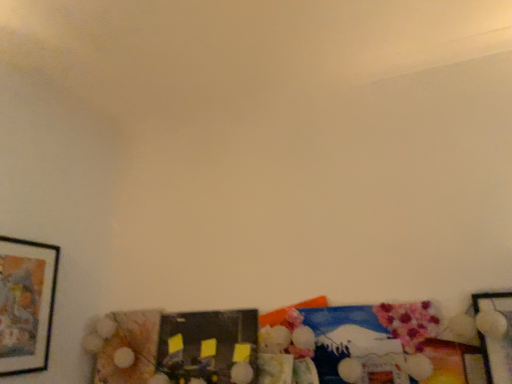
Question: From the image's perspective, is matte black picture frame at center, placed as the second picture frame when sorted from left to right, under matte black picture frame at left, acting as the 3th picture frame starting from the right?

Choices:
 (A) no
 (B) yes

Answer: (B)

Question: Is the position of matte black picture frame at center, placed as the second picture frame when sorted from left to right, more distant than that of matte black picture frame at left, the 1th picture frame from the left?

Choices:
 (A) yes
 (B) no

Answer: (A)

Question: Considering the relative sizes of matte black picture frame at center, the second picture frame from the right, and matte black picture frame at left, the 1th picture frame from the left, in the image provided, is matte black picture frame at center, the second picture frame from the right, taller than matte black picture frame at left, the 1th picture frame from the left,?

Choices:
 (A) yes
 (B) no

Answer: (B)

Question: Does matte black picture frame at center, placed as the second picture frame when sorted from left to right, have a lesser width compared to matte black picture frame at left, the 1th picture frame from the left?

Choices:
 (A) yes
 (B) no

Answer: (B)

Question: From a real-world perspective, is matte black picture frame at center, placed as the second picture frame when sorted from left to right, positioned over matte black picture frame at left, the 1th picture frame from the left, based on gravity?

Choices:
 (A) no
 (B) yes

Answer: (A)

Question: Is matte black picture frame at center, the second picture frame from the right, oriented away from matte black picture frame at left, the 1th picture frame from the left?

Choices:
 (A) yes
 (B) no

Answer: (B)

Question: Can you confirm if metallic silver picture frame at lower right, the 3th picture frame positioned from the left, is thinner than matte black picture frame at center, the second picture frame from the right?

Choices:
 (A) no
 (B) yes

Answer: (A)

Question: Is matte black picture frame at center, the second picture frame from the right, at the back of metallic silver picture frame at lower right, marked as the first picture frame in a right-to-left arrangement?

Choices:
 (A) yes
 (B) no

Answer: (B)

Question: Is metallic silver picture frame at lower right, the 3th picture frame positioned from the left, beside matte black picture frame at center, placed as the second picture frame when sorted from left to right?

Choices:
 (A) no
 (B) yes

Answer: (A)

Question: From a real-world perspective, is metallic silver picture frame at lower right, marked as the first picture frame in a right-to-left arrangement, under matte black picture frame at center, the second picture frame from the right?

Choices:
 (A) yes
 (B) no

Answer: (B)

Question: Considering the relative sizes of metallic silver picture frame at lower right, the 3th picture frame positioned from the left, and matte black picture frame at center, the second picture frame from the right, in the image provided, is metallic silver picture frame at lower right, the 3th picture frame positioned from the left, wider than matte black picture frame at center, the second picture frame from the right,?

Choices:
 (A) no
 (B) yes

Answer: (B)

Question: Can you confirm if metallic silver picture frame at lower right, marked as the first picture frame in a right-to-left arrangement, is positioned to the left of matte black picture frame at center, the second picture frame from the right?

Choices:
 (A) no
 (B) yes

Answer: (A)

Question: Can you confirm if matte black picture frame at left, the 1th picture frame from the left, is bigger than matte black picture frame at center, the second picture frame from the right?

Choices:
 (A) yes
 (B) no

Answer: (B)